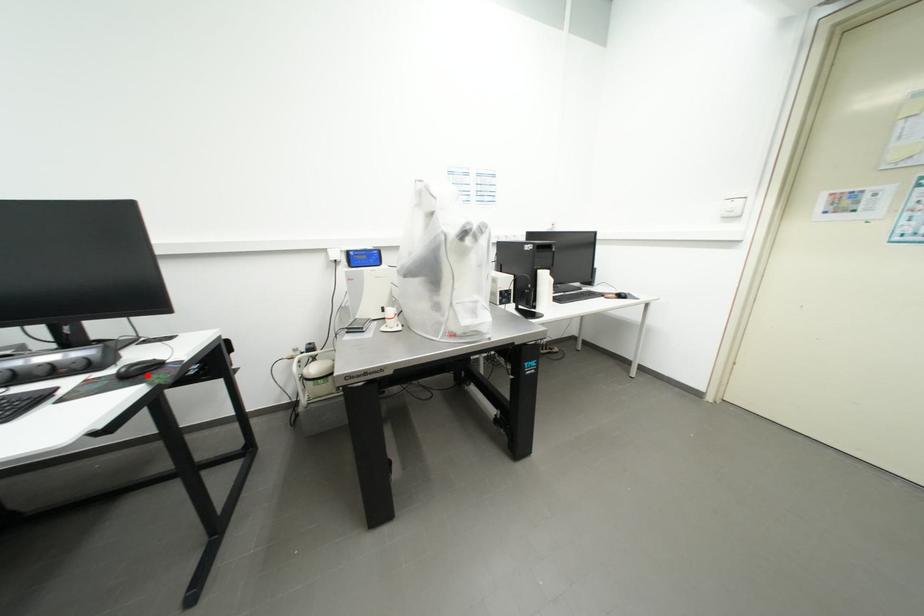
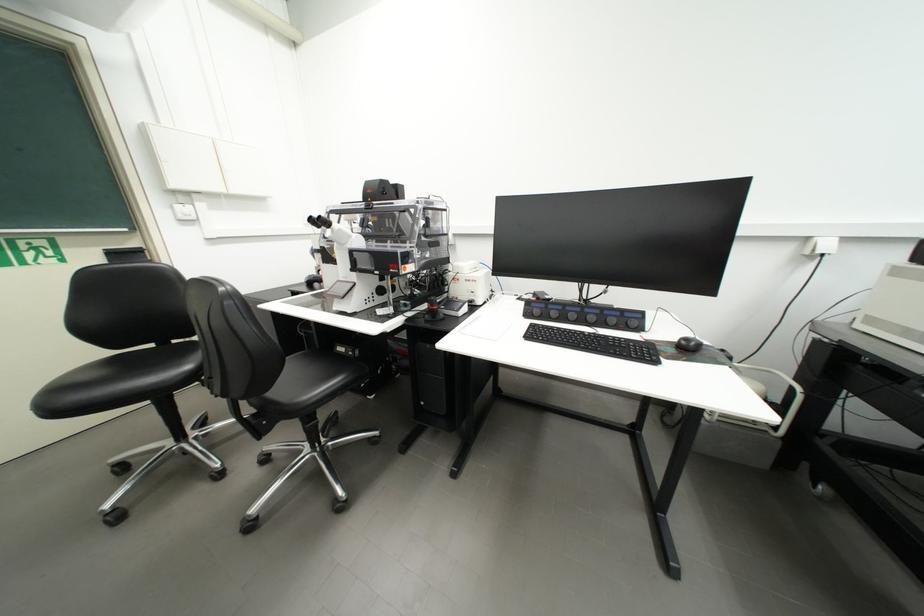
The point at the highlighted location is marked in the first image. Where is the corresponding point in the second image?

(697, 351)